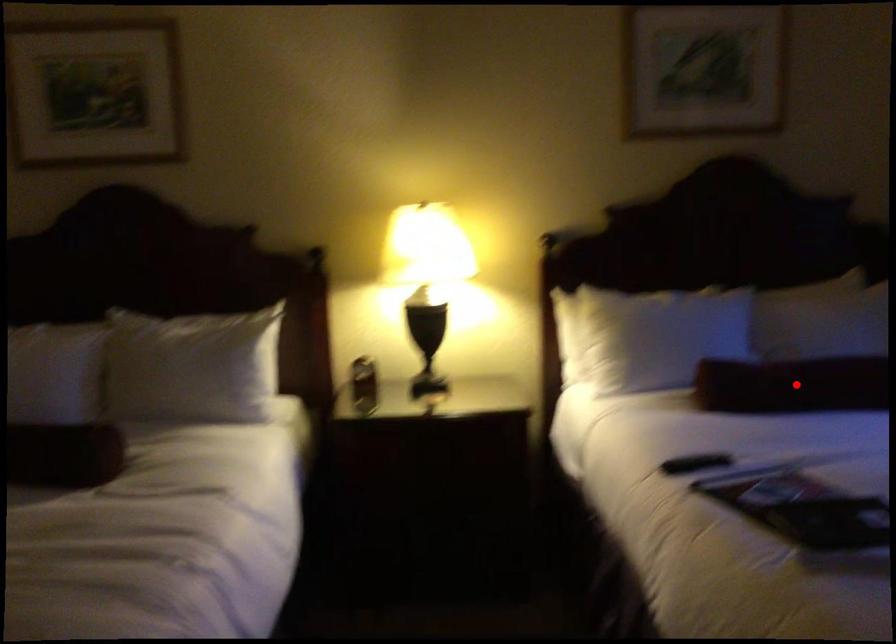
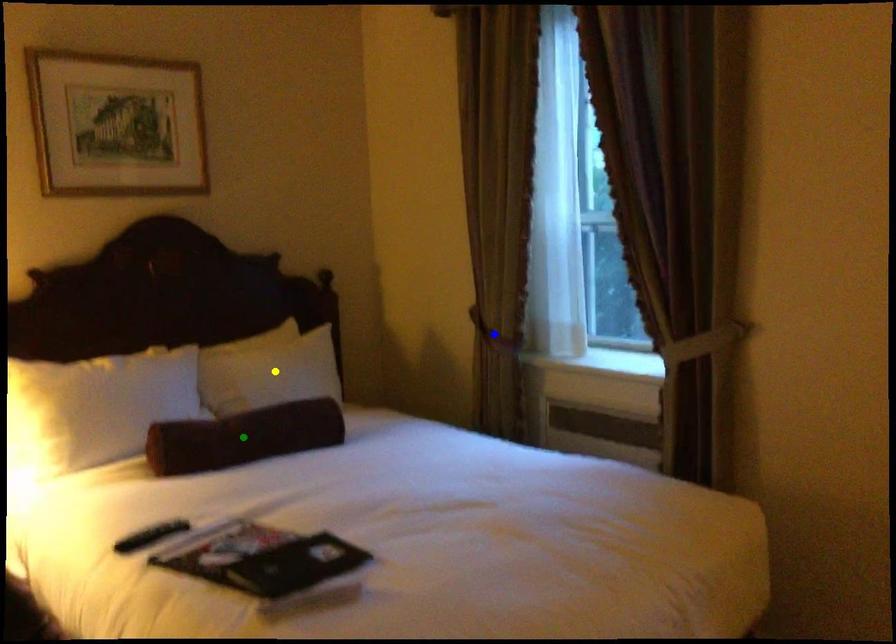
Question: I am providing you with two images of the same scene from different viewpoints. A red point is marked on the first image. You are given multiple points on the second image. Which mark in image 2 goes with the point in image 1?

Choices:
 (A) green point
 (B) blue point
 (C) yellow point

Answer: (A)